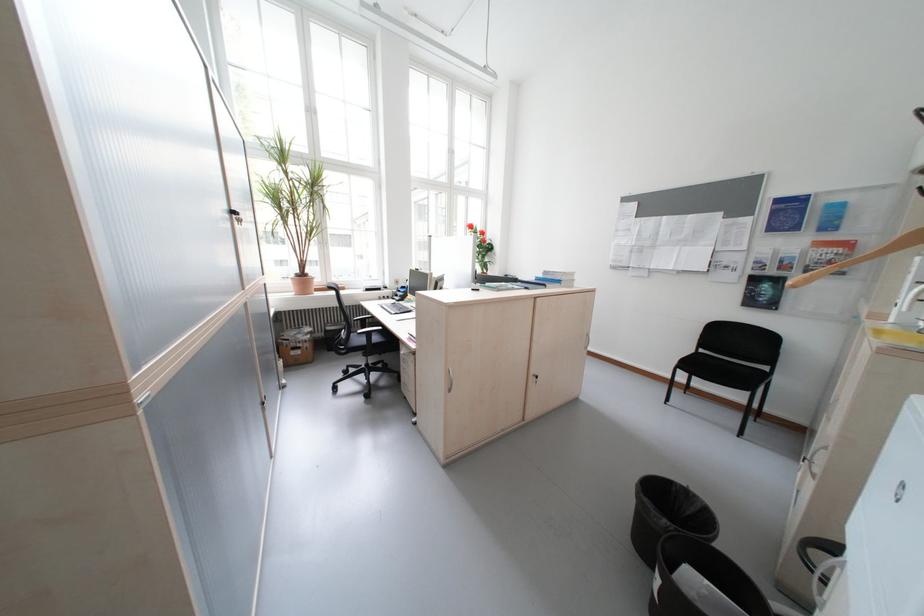
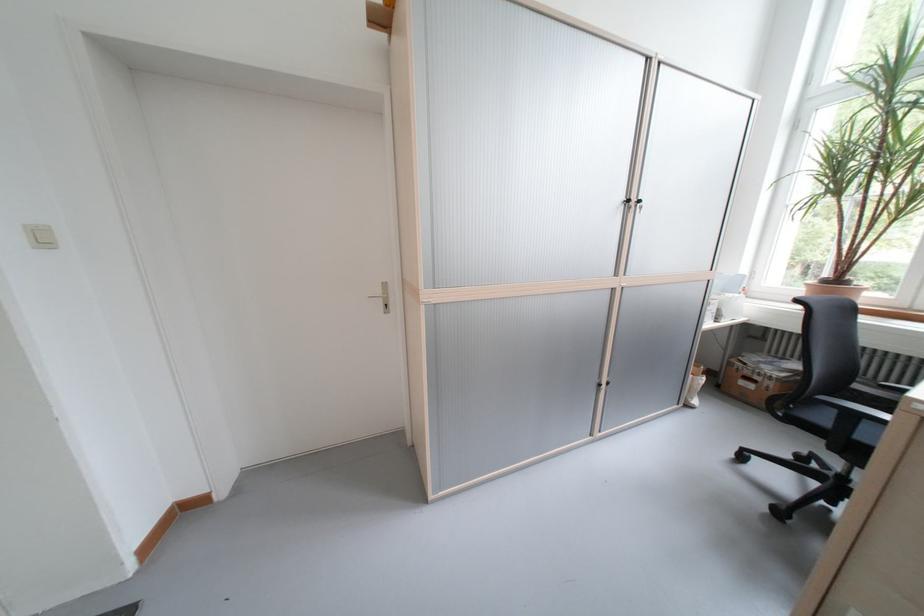
The images are taken continuously from a first-person perspective. In which direction is your viewpoint rotating?

The rotation direction of the camera is left-down.